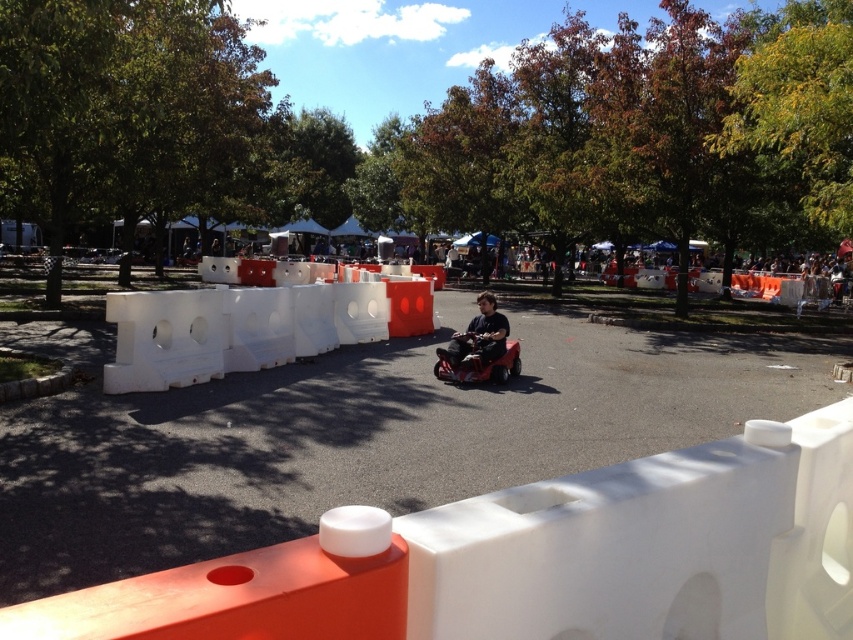
Question: Which of the following is the closest to the observer?

Choices:
 (A) dark gray fabric jacket at center
 (B) red plastic mobility scooter at center

Answer: (B)

Question: Which of these objects is positioned closest to the white plastic barrier at center?

Choices:
 (A) dark gray fabric jacket at center
 (B) red plastic mobility scooter at center

Answer: (B)

Question: Can you confirm if white plastic barrier at center is smaller than red plastic mobility scooter at center?

Choices:
 (A) no
 (B) yes

Answer: (A)

Question: Among these points, which one is nearest to the camera?

Choices:
 (A) (x=479, y=360)
 (B) (x=131, y=388)

Answer: (B)

Question: Can you confirm if white plastic barrier at center is thinner than dark gray fabric jacket at center?

Choices:
 (A) yes
 (B) no

Answer: (B)

Question: Does white plastic barrier at center appear on the left side of dark gray fabric jacket at center?

Choices:
 (A) yes
 (B) no

Answer: (A)